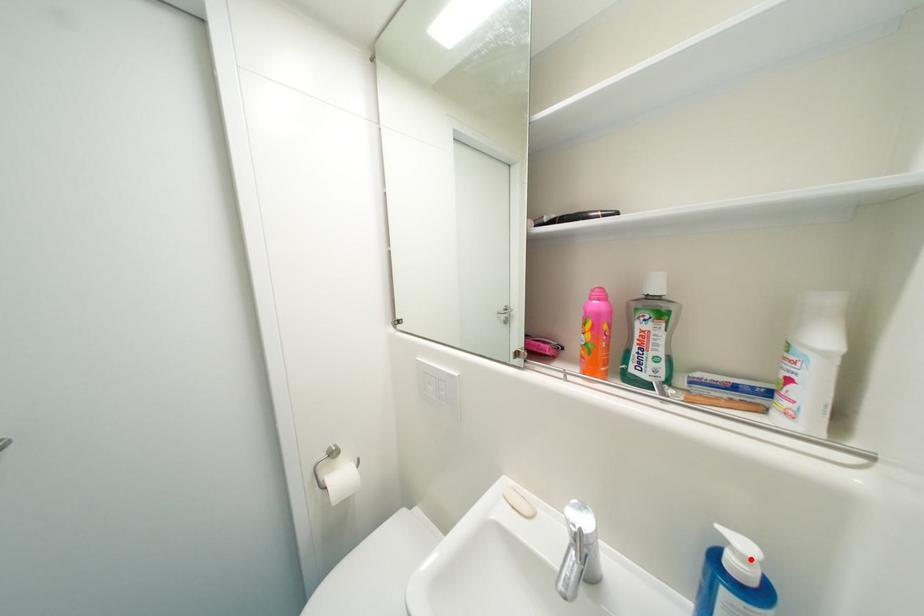
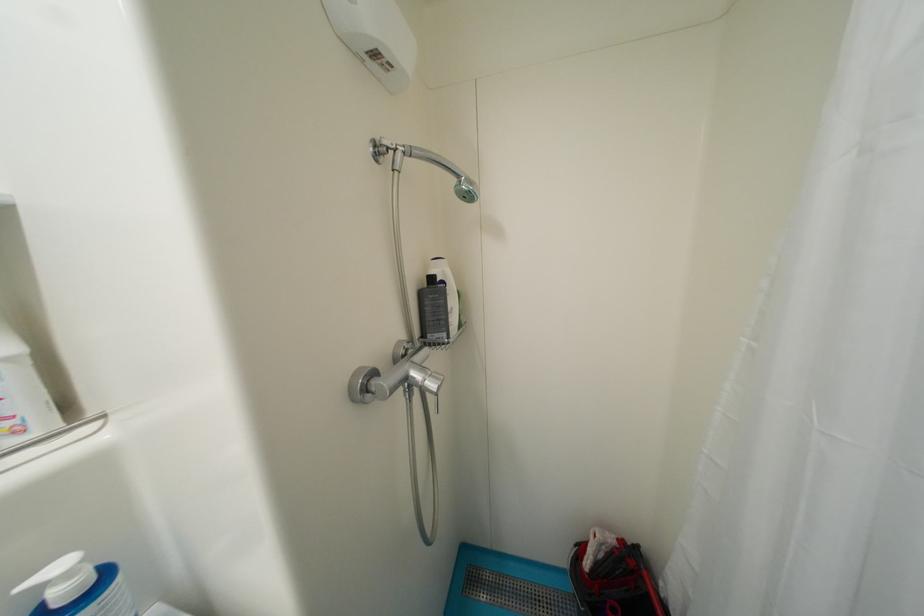
Where in the second image is the point corresponding to the highlighted location from the first image?

(75, 576)